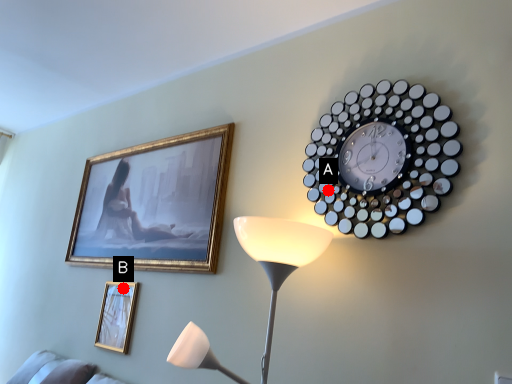
Question: Two points are circled on the image, labeled by A and B beside each circle. Among these points, which one is nearest to the camera?

Choices:
 (A) A is closer
 (B) B is closer

Answer: (A)